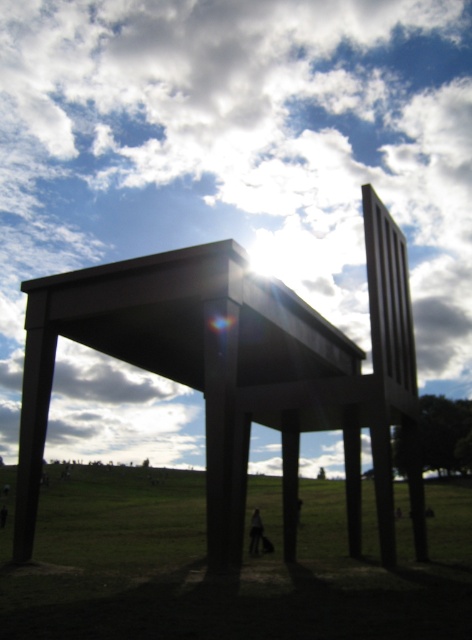
You are standing in front of the large chair and want to locate two specific points marked in the image. The first point is at coordinates point (443, 390) and the second is at point (269, 592). Which of these points is closer to you?

Point (443, 390) is closer to you because it is further to the viewer than point (269, 592).

You are a photographer trying to capture the white fluffy cloud at upper center and the green grass at lower center in a single frame. Given that your camera can only focus on one object at a time, which object should you focus on to ensure it appears larger in the photo?

The white fluffy cloud at upper center is bigger than the green grass at lower center, so focusing on the white fluffy cloud at upper center will ensure it appears larger in the photo.